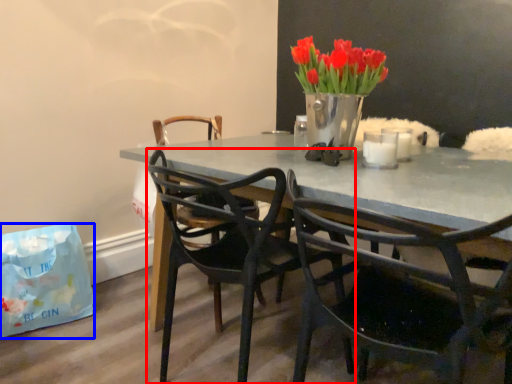
Question: Which point is further to the camera, chair (highlighted by a red box) or handbag (highlighted by a blue box)?

Choices:
 (A) chair
 (B) handbag

Answer: (B)